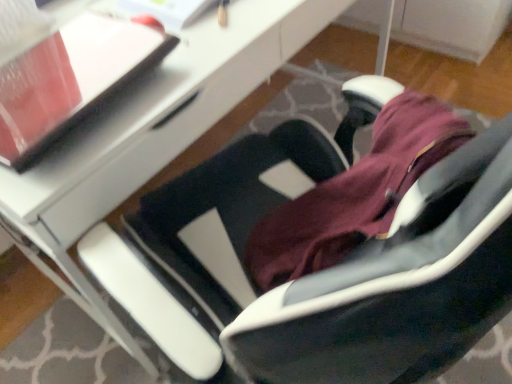
Question: From the image's perspective, is white glossy desk at center above or below matte black notepad at upper left?

Choices:
 (A) below
 (B) above

Answer: (B)

Question: In terms of width, does white glossy desk at center look wider or thinner when compared to matte black notepad at upper left?

Choices:
 (A) thin
 (B) wide

Answer: (B)

Question: From their relative heights in the image, would you say white glossy desk at center is taller or shorter than matte black notepad at upper left?

Choices:
 (A) short
 (B) tall

Answer: (B)

Question: Based on their positions, is matte black notepad at upper left located to the left or right of white glossy desk at center?

Choices:
 (A) right
 (B) left

Answer: (B)

Question: From the image's perspective, relative to white glossy desk at center, is matte black notepad at upper left above or below?

Choices:
 (A) above
 (B) below

Answer: (B)

Question: From a real-world perspective, is matte black notepad at upper left positioned above or below white glossy desk at center?

Choices:
 (A) below
 (B) above

Answer: (B)

Question: In the image, is matte black notepad at upper left positioned in front of or behind white glossy desk at center?

Choices:
 (A) behind
 (B) front

Answer: (B)